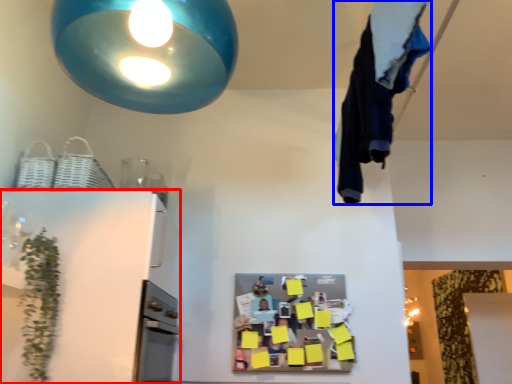
Question: Which point is closer to the camera, appliance (highlighted by a red box) or laundry (highlighted by a blue box)?

Choices:
 (A) appliance
 (B) laundry

Answer: (B)